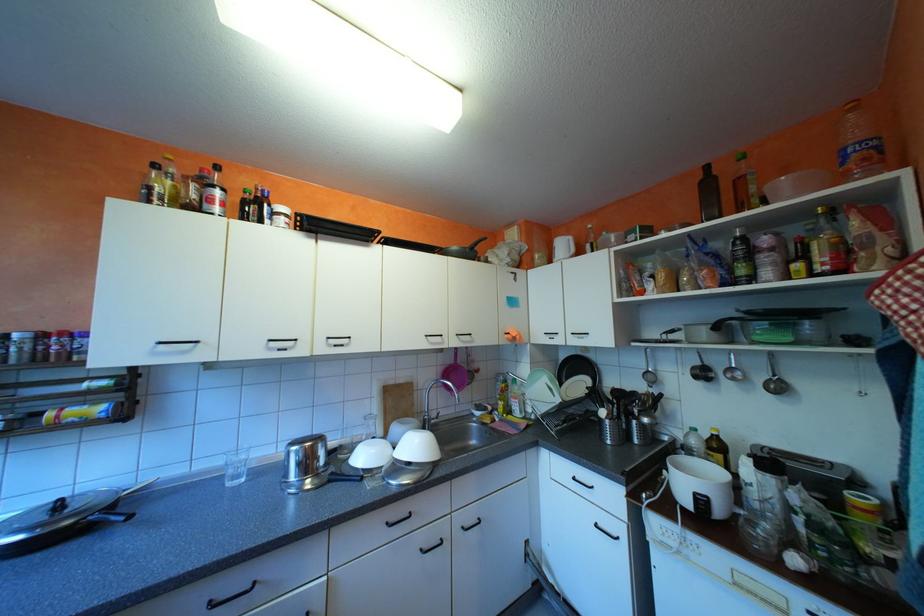
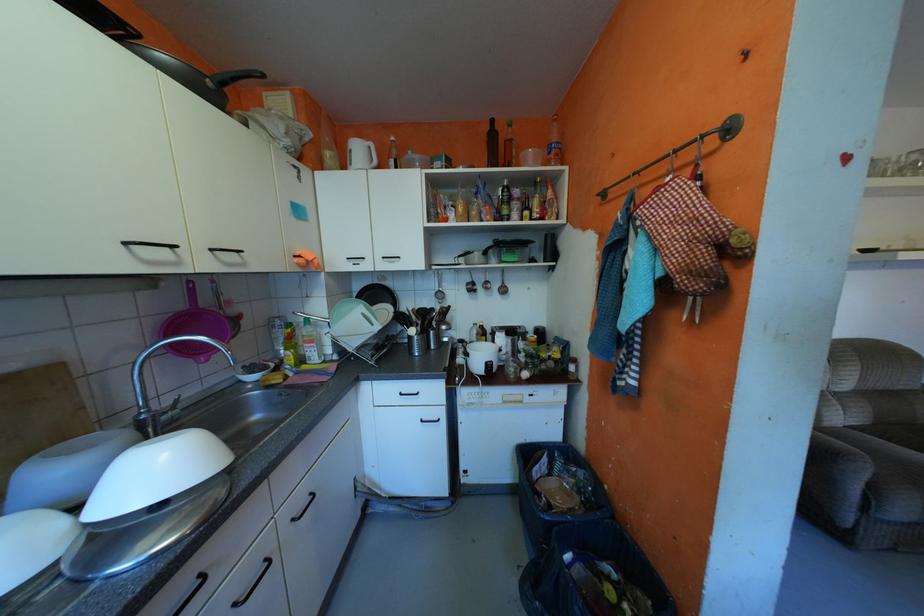
Question: Based on the continuous images, in which direction is the camera rotating? Reply with the corresponding letter.

Choices:
 (A) Left
 (B) Right
 (C) Up
 (D) Down

Answer: (B)